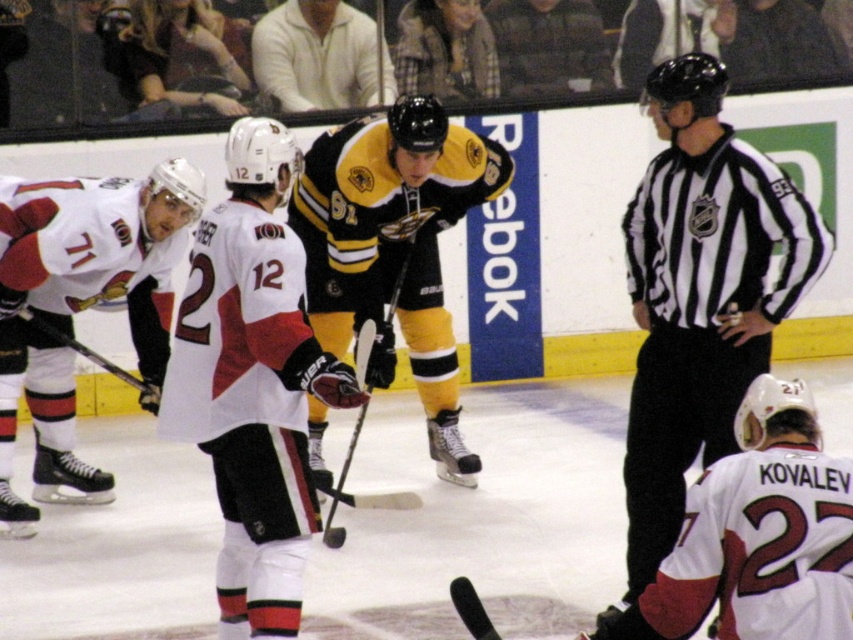
Who is taller, black matte jersey at center or white matte jersey at lower right?

black matte jersey at center is taller.

Is black matte jersey at center closer to the viewer compared to white matte jersey at lower right?

No, black matte jersey at center is behind white matte jersey at lower right.

Where is `black matte jersey at center`? The height and width of the screenshot is (640, 853). black matte jersey at center is located at coordinates (393, 246).

This screenshot has width=853, height=640. Describe the element at coordinates (700, 296) in the screenshot. I see `black and white striped shirt at center` at that location.

Can you confirm if black and white striped shirt at center is positioned above white matte jersey at left?

Actually, black and white striped shirt at center is below white matte jersey at left.

The height and width of the screenshot is (640, 853). Identify the location of black and white striped shirt at center. (700, 296).

This screenshot has height=640, width=853. I want to click on black and white striped shirt at center, so click(700, 296).

Is point (699, 97) closer to camera compared to point (303, 172)?

Yes, point (699, 97) is in front of point (303, 172).

Can you confirm if black and white striped shirt at center is positioned above black matte jersey at center?

Incorrect, black and white striped shirt at center is not positioned above black matte jersey at center.

At what (x,y) coordinates should I click in order to perform the action: click on black and white striped shirt at center. Please return your answer as a coordinate pair (x, y). Looking at the image, I should click on [700, 296].